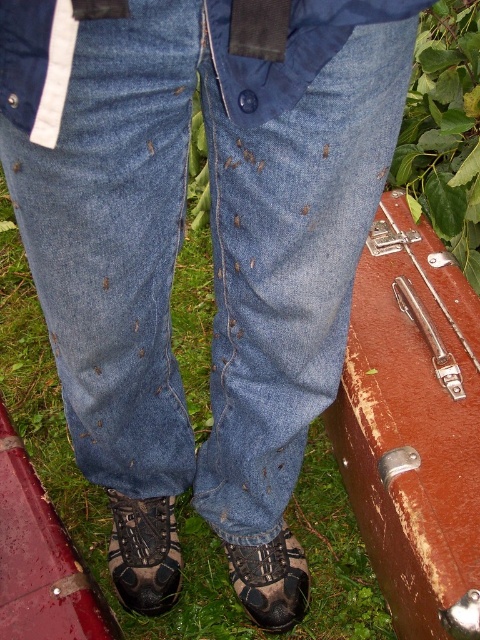
Does denim at center have a lesser width compared to brown suede boot at lower center?

No, denim at center is not thinner than brown suede boot at lower center.

Is the position of denim at center more distant than that of brown suede boot at lower center?

No.

The height and width of the screenshot is (640, 480). Describe the element at coordinates (212, 232) in the screenshot. I see `denim at center` at that location.

You are a GUI agent. You are given a task and a screenshot of the screen. Output one action in this format:
    pyautogui.click(x=<x>, y=<y>)
    Task: Click on the denim at center
    
    Given the screenshot: What is the action you would take?
    pyautogui.click(x=212, y=232)

Can you confirm if denim at center is bigger than brown leather boot at lower left?

Correct, denim at center is larger in size than brown leather boot at lower left.

Does denim at center have a greater height compared to brown leather boot at lower left?

Indeed, denim at center has a greater height compared to brown leather boot at lower left.

Locate an element on the screen. The height and width of the screenshot is (640, 480). denim at center is located at coordinates (212, 232).

The height and width of the screenshot is (640, 480). Identify the location of denim at center. (212, 232).

Which of these two, brown leather boot at lower left or brown suede boot at lower center, stands taller?

With more height is brown leather boot at lower left.

How far apart are brown leather boot at lower left and brown suede boot at lower center?

brown leather boot at lower left is 7.16 inches away from brown suede boot at lower center.

What do you see at coordinates (144, 554) in the screenshot?
I see `brown leather boot at lower left` at bounding box center [144, 554].

Locate an element on the screen. The image size is (480, 640). brown leather boot at lower left is located at coordinates (144, 554).